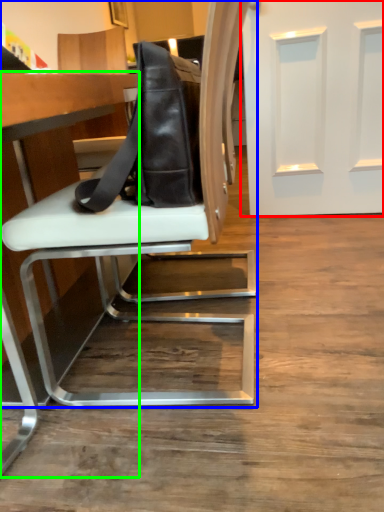
Question: Which is farther away from door (highlighted by a red box)? chair (highlighted by a blue box) or table (highlighted by a green box)?

Choices:
 (A) chair
 (B) table

Answer: (B)